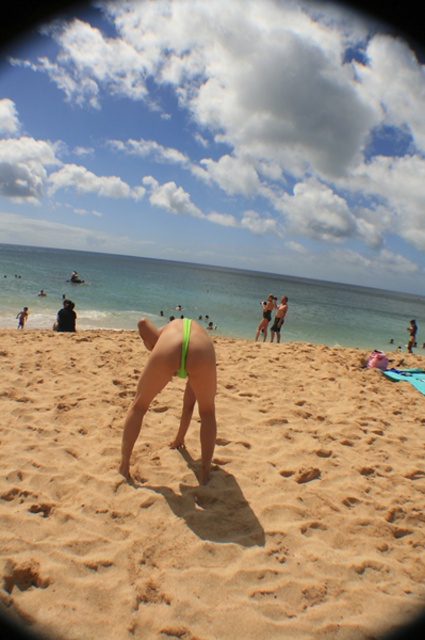
Question: Which object is the farthest from the matte white bikini top at center?

Choices:
 (A) green fabric bikini bottom at center
 (B) light brown sandy beach at center

Answer: (B)

Question: Estimate the real-world distances between objects in this image. Which object is farther from the green fabric bikini bottom at center?

Choices:
 (A) light brown sandy beach at center
 (B) matte white bikini top at center

Answer: (A)

Question: Where is light brown sandy beach at center located in relation to green fabric bikini bottom at center in the image?

Choices:
 (A) above
 (B) below

Answer: (B)

Question: Which is nearer to the matte white bikini top at center?

Choices:
 (A) light brown sandy beach at center
 (B) green fabric bikini bottom at center

Answer: (B)

Question: Is light brown sandy beach at center to the left of matte white bikini top at center from the viewer's perspective?

Choices:
 (A) no
 (B) yes

Answer: (A)

Question: Is light brown sandy beach at center to the right of green fabric bikini bottom at center from the viewer's perspective?

Choices:
 (A) no
 (B) yes

Answer: (B)